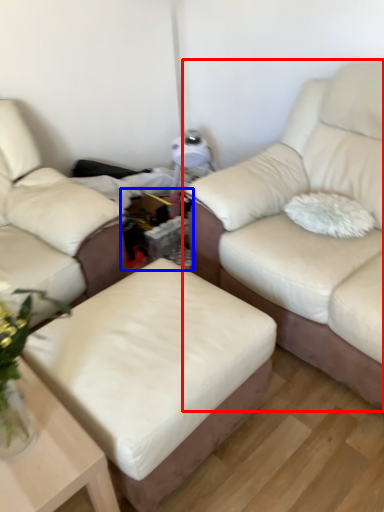
Question: Which of the following is the farthest to the observer, studio couch (highlighted by a red box) or cocktail table (highlighted by a blue box)?

Choices:
 (A) studio couch
 (B) cocktail table

Answer: (B)